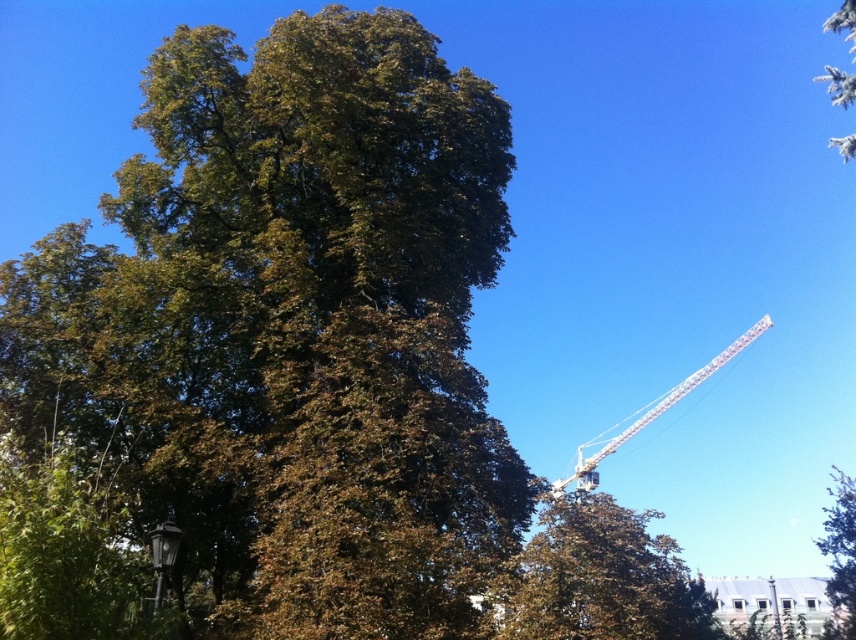
Is green leafy tree at upper right in front of white fluffy snow at upper right?

That is False.

Which is behind, point (834, 550) or point (816, 76)?

Positioned behind is point (816, 76).

This screenshot has width=856, height=640. What are the coordinates of `green leafy tree at upper right` in the screenshot? It's located at (840, 554).

Which of these two, green leafy tree at upper center or green leafy tree at upper right, stands shorter?

Standing shorter between the two is green leafy tree at upper right.

Is green leafy tree at upper center positioned behind green leafy tree at upper right?

No.

The height and width of the screenshot is (640, 856). Find the location of `green leafy tree at upper center`. green leafy tree at upper center is located at coordinates (601, 579).

Describe the element at coordinates (651, 413) in the screenshot. This screenshot has height=640, width=856. I see `white metallic crane at upper right` at that location.

Is white metallic crane at upper right taller than white fluffy snow at upper right?

No, white metallic crane at upper right is not taller than white fluffy snow at upper right.

Measure the distance between white metallic crane at upper right and camera.

A distance of 7.61 meters exists between white metallic crane at upper right and camera.

Locate an element on the screen. The width and height of the screenshot is (856, 640). white metallic crane at upper right is located at coordinates (651, 413).